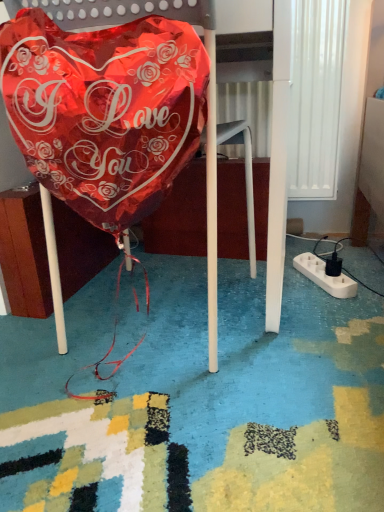
The height and width of the screenshot is (512, 384). In order to click on spots to the right of white plastic extension cord at lower right in this screenshot , I will do `click(364, 273)`.